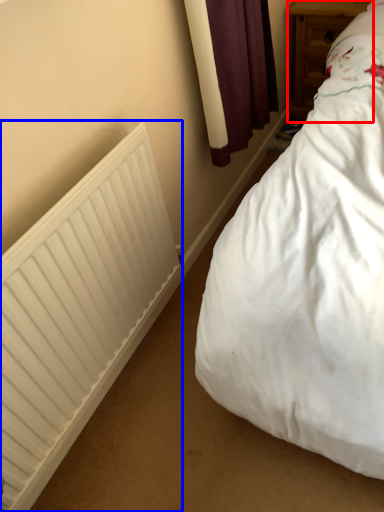
Question: Which of the following is the closest to the observer, furniture (highlighted by a red box) or radiator (highlighted by a blue box)?

Choices:
 (A) furniture
 (B) radiator

Answer: (B)